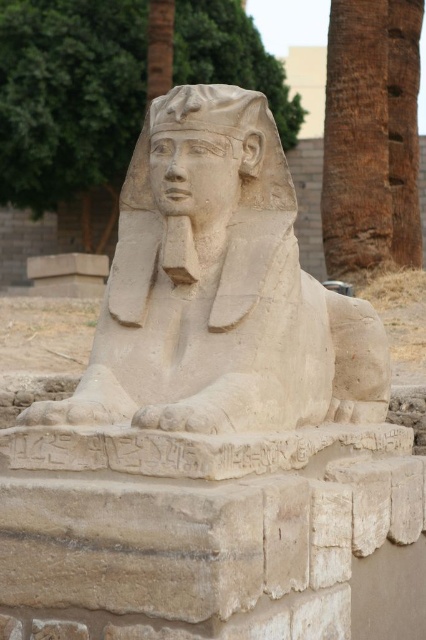
You are an archaeologist standing in front of the beige stone sphinx at center. You want to take a photo of the brown textured palm tree at upper right without the sphinx blocking the view. In which direction should you move to ensure the palm tree is visible without the sphinx obstructing it?

The beige stone sphinx at center is to the left of the brown textured palm tree at upper right. To avoid the sphinx blocking the view, you should move to the right side of the sphinx so that the palm tree at upper right becomes visible without obstruction.

From the picture: You are an archaeologist examining the sphinx statue. You notice two points marked on the statue. The first point is at coordinate point (359,212) and the second is at point (152,132). From your vantage point, which point is closer to you?

Point (152,132) is closer to you because it is in front of point (359,212) according to the description.

You are an archaeologist examining the ancient Egyptian sphinx statue. You notice two parts of the statue labeled as the beige stone sphinx at center and the beige stone head at center. Which part is located below the other?

The beige stone sphinx at center is positioned under the beige stone head at center, meaning the sphinx part is below the head.